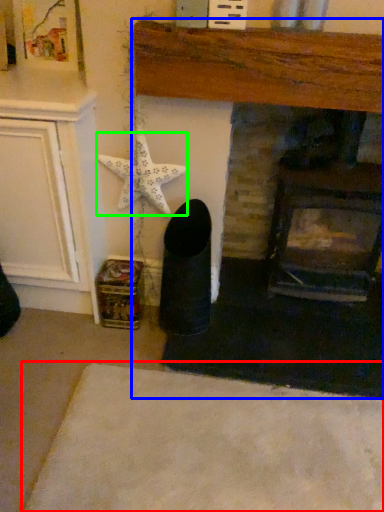
Question: Which object is the farthest from plain (highlighted by a red box)? Choose among these: fireplace (highlighted by a blue box) or starfish (highlighted by a green box).

Choices:
 (A) fireplace
 (B) starfish

Answer: (B)